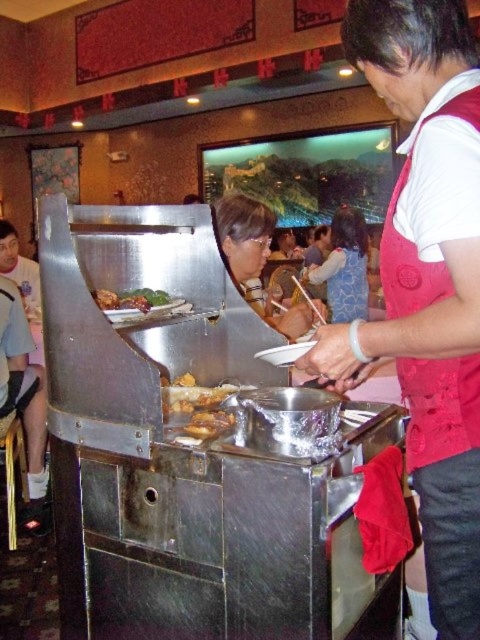
Question: Which point is farther from the camera taking this photo?

Choices:
 (A) (217, 525)
 (B) (10, 225)

Answer: (B)

Question: Does matte black hair at center have a smaller size compared to shiny brown meat at center?

Choices:
 (A) no
 (B) yes

Answer: (A)

Question: Does brushed metal buffet at center have a larger size compared to brown matte food at center?

Choices:
 (A) no
 (B) yes

Answer: (B)

Question: Does golden-brown crispy chicken at center have a lesser width compared to matte black shirt at center?

Choices:
 (A) yes
 (B) no

Answer: (A)

Question: Which point is farther to the camera?

Choices:
 (A) (331, 300)
 (B) (468, 40)
 (C) (8, 237)

Answer: (A)

Question: Which point is farther to the camera?

Choices:
 (A) (96, 304)
 (B) (340, 321)
 (C) (239, 262)
 (D) (212, 394)

Answer: (B)